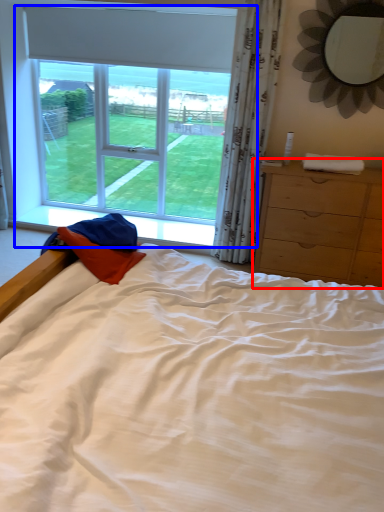
Question: Which object appears farthest to the camera in this image, chest of drawers (highlighted by a red box) or window (highlighted by a blue box)?

Choices:
 (A) chest of drawers
 (B) window

Answer: (B)